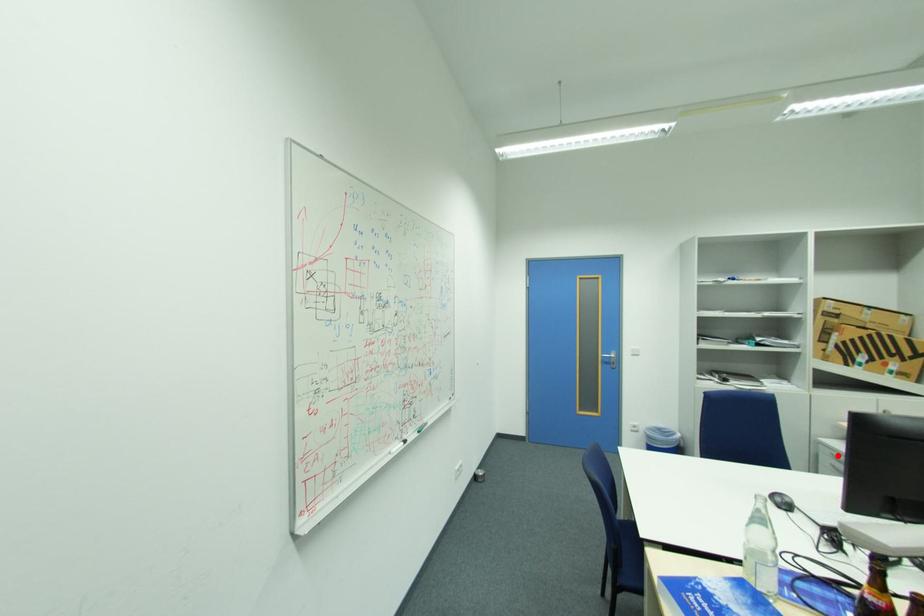
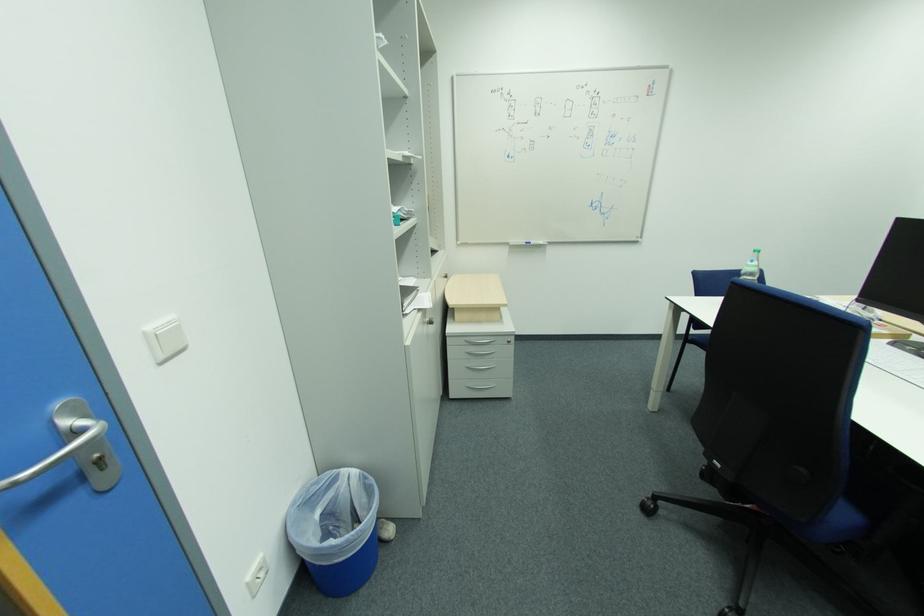
Question: I am providing you with two images of the same scene from different viewpoints. Image1 has a red point marked. In image2, the corresponding 3D location appears at what relative position? Reply with the corresponding letter.

Choices:
 (A) Closer
 (B) Farther

Answer: (A)